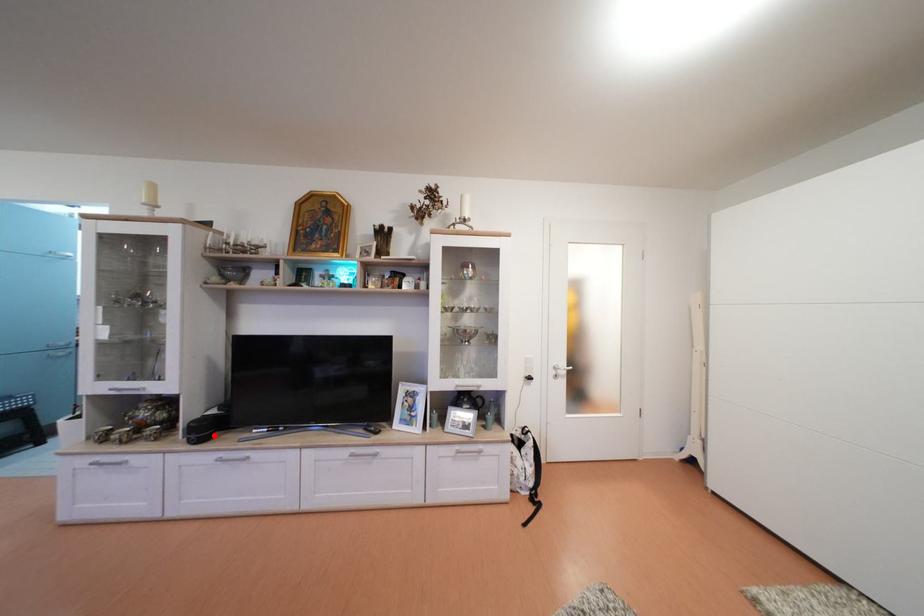
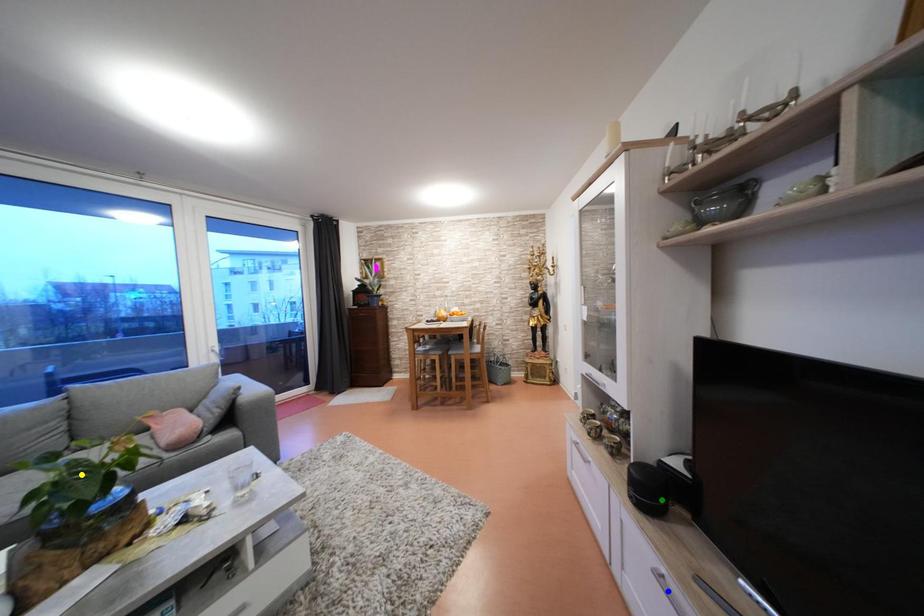
Question: I am providing you with two images of the same scene from different viewpoints. A red point is marked on the first image. You are given multiple points on the second image. Can you choose the point in image 2 that corresponds to the point in image 1?

Choices:
 (A) green point
 (B) blue point
 (C) yellow point

Answer: (A)